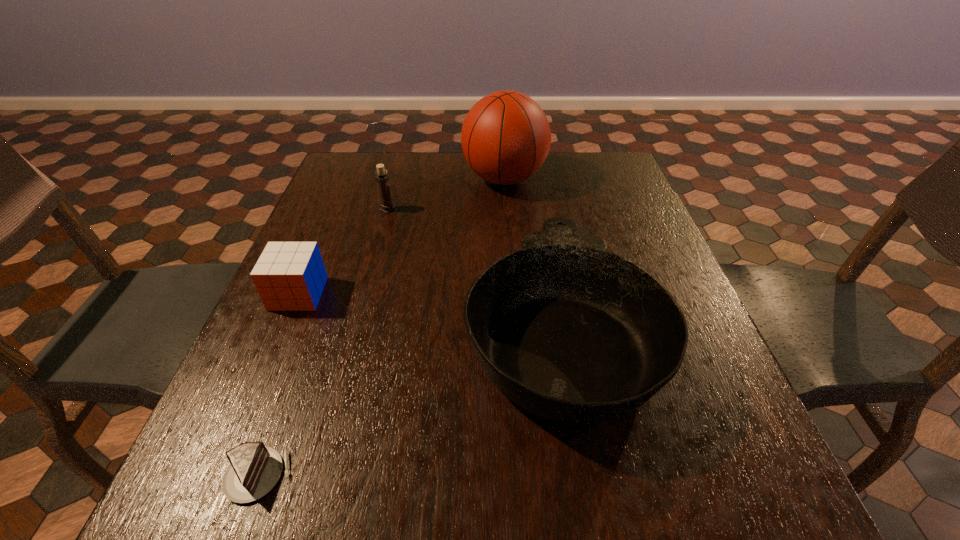
Image resolution: width=960 pixels, height=540 pixels. What are the coordinates of `the farthest object` in the screenshot? It's located at (506, 137).

Image resolution: width=960 pixels, height=540 pixels. I want to click on basketball, so click(506, 137).

At what (x,y) coordinates should I click in order to perform the action: click on the third object from left to right. Please return your answer as a coordinate pair (x, y). Image resolution: width=960 pixels, height=540 pixels. Looking at the image, I should click on (382, 180).

Where is `the second farthest object`? This screenshot has width=960, height=540. the second farthest object is located at coordinates (382, 180).

The image size is (960, 540). What are the coordinates of `frying pan` in the screenshot? It's located at (568, 331).

Locate an element on the screen. The height and width of the screenshot is (540, 960). cube is located at coordinates (289, 276).

I want to click on the shortest object, so click(254, 469).

I want to click on vacant position located on the left of the tallest object, so click(x=422, y=179).

Locate an element on the screen. The width and height of the screenshot is (960, 540). blank area located 0.090m on the right of the third object from left to right is located at coordinates (428, 210).

At what (x,y) coordinates should I click in order to perform the action: click on vacant point located 0.140m with the handle extending from the side of the frying pan. Please return your answer as a coordinate pair (x, y). Looking at the image, I should click on (540, 215).